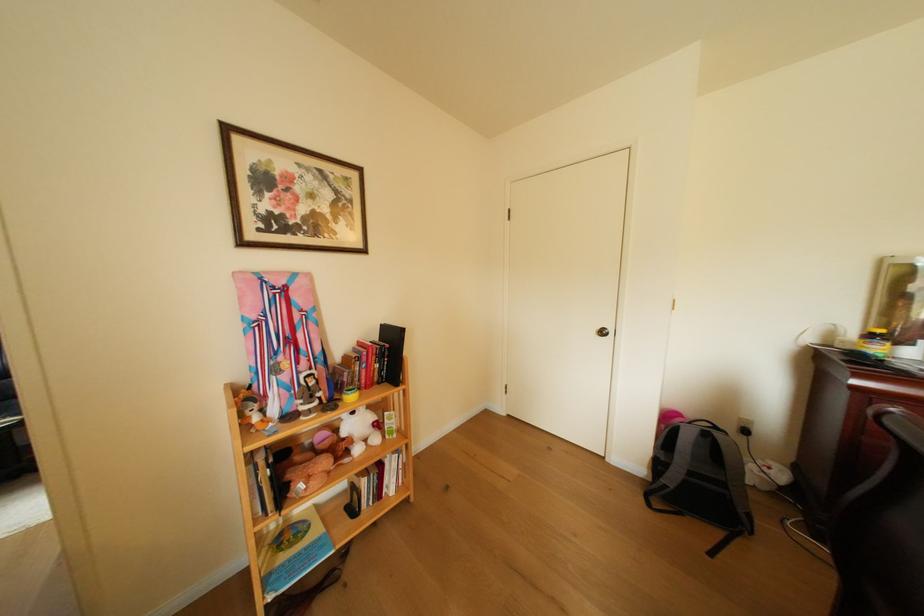
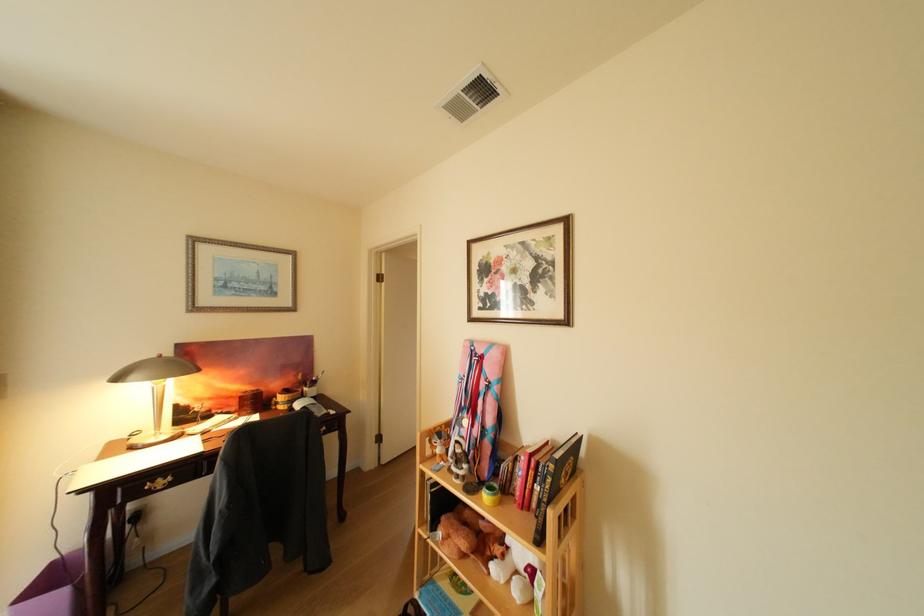
In the second image, find the point that corresponds to point (302, 477) in the first image.

(456, 519)